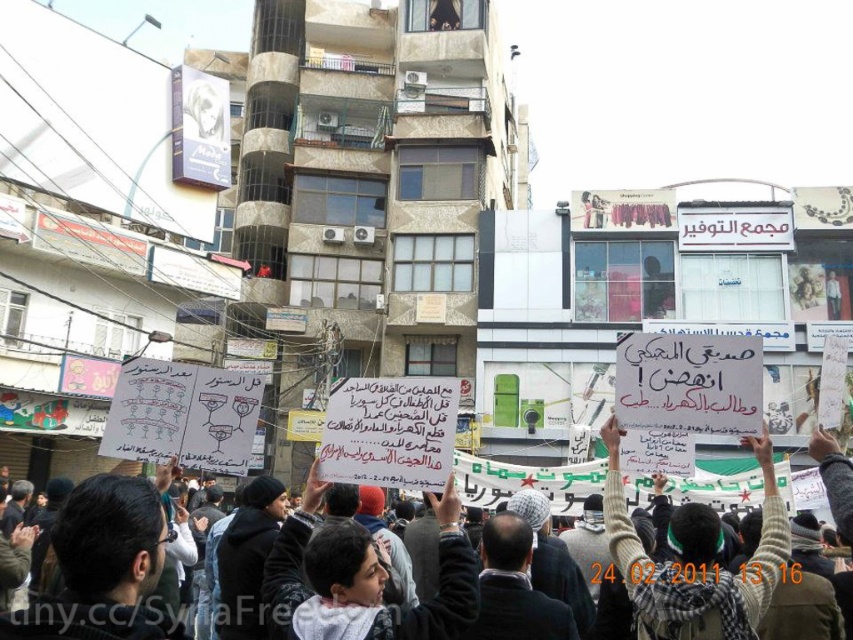
Question: Does white paper sign at center have a smaller size compared to white knitted sweater at center?

Choices:
 (A) yes
 (B) no

Answer: (B)

Question: Where is white paper sign at center located in relation to white knitted sweater at center in the image?

Choices:
 (A) right
 (B) left

Answer: (B)

Question: Which point is farther to the camera?

Choices:
 (A) white knitted sweater at center
 (B) white paper sign at center

Answer: (A)

Question: Can you confirm if white paper sign at center is smaller than white knitted sweater at center?

Choices:
 (A) no
 (B) yes

Answer: (A)

Question: Which point is farther from the camera taking this photo?

Choices:
 (A) (746, 609)
 (B) (755, 625)

Answer: (B)

Question: Among these objects, which one is farthest from the camera?

Choices:
 (A) white knitted sweater at center
 (B) white paper sign at center

Answer: (A)